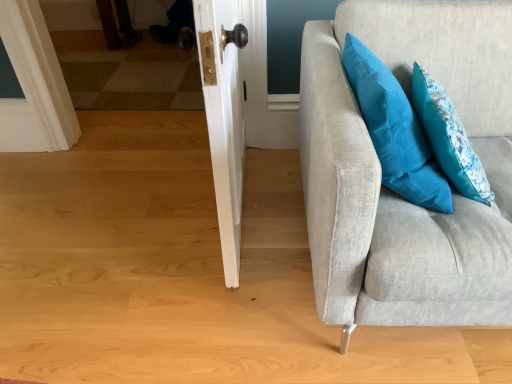
Question: Is point (434, 119) closer or farther from the camera than point (370, 92)?

Choices:
 (A) farther
 (B) closer

Answer: (A)

Question: Relative to teal fabric pillow at upper right, positioned as the 2th pillow in right-to-left order, is teal fabric pillow at upper right, which is counted as the 2th pillow, starting from the left, in front or behind?

Choices:
 (A) front
 (B) behind

Answer: (B)

Question: Considering the real-world distances, which object is closest to the teal fabric pillow at upper right, the 1th pillow when ordered from left to right?

Choices:
 (A) teal fabric pillow at upper right, placed as the 1th pillow when sorted from right to left
 (B) light gray fabric couch at right

Answer: (A)

Question: Which of these objects is positioned farthest from the teal fabric pillow at upper right, placed as the 1th pillow when sorted from right to left?

Choices:
 (A) light gray fabric couch at right
 (B) teal fabric pillow at upper right, positioned as the 2th pillow in right-to-left order

Answer: (A)